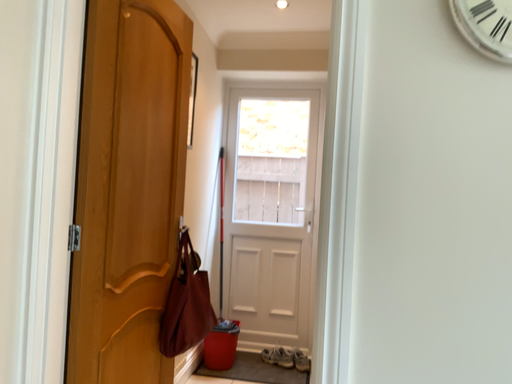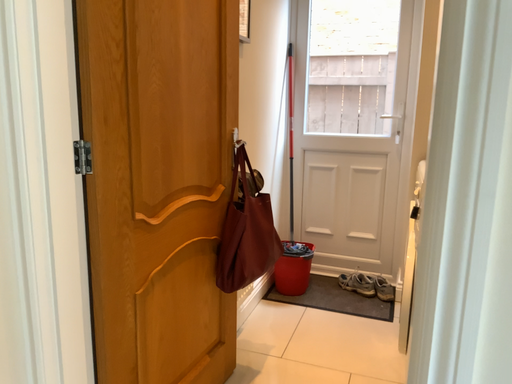
Question: Which way did the camera rotate in the video?

Choices:
 (A) rotated left
 (B) rotated right

Answer: (A)